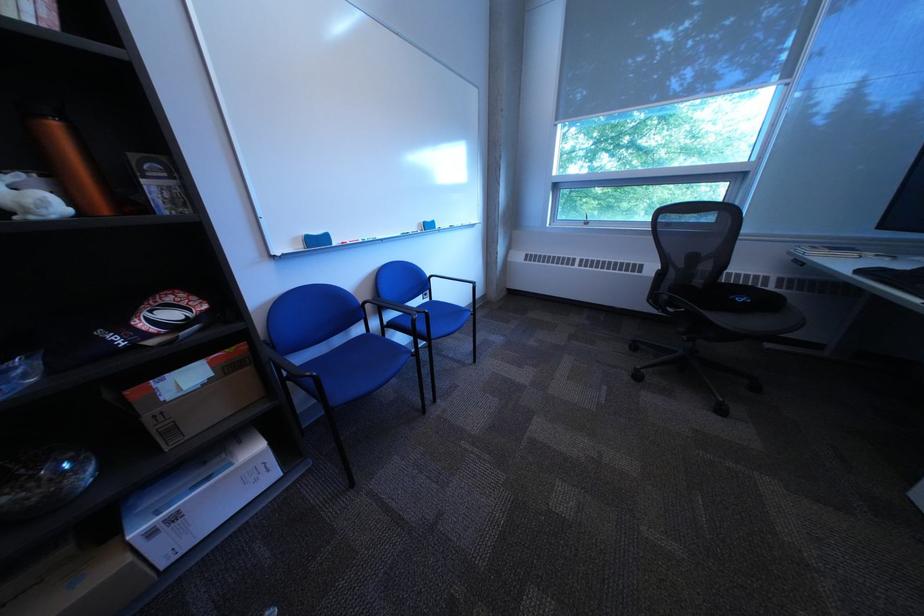
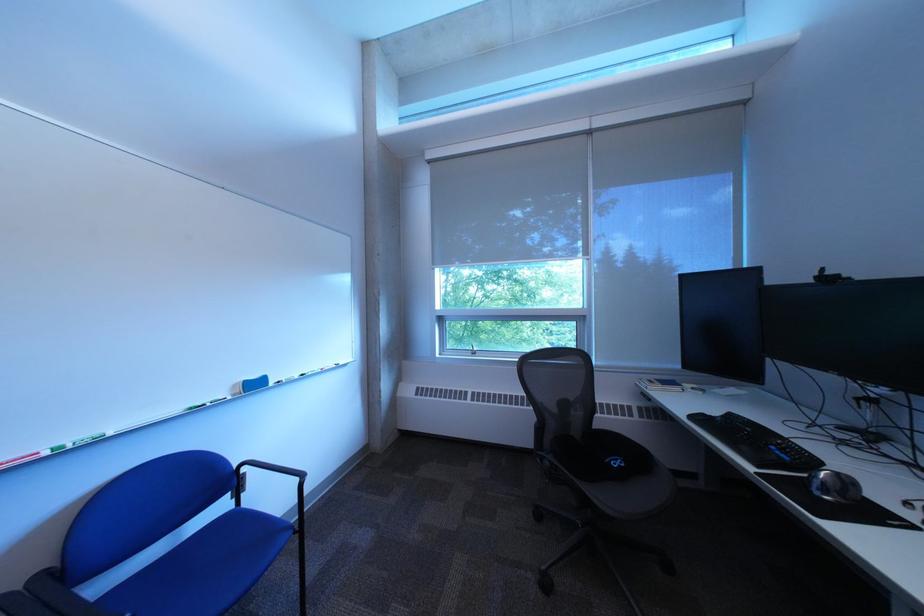
The point at [805,254] is marked in the first image. Where is the corresponding point in the second image?

(651, 386)